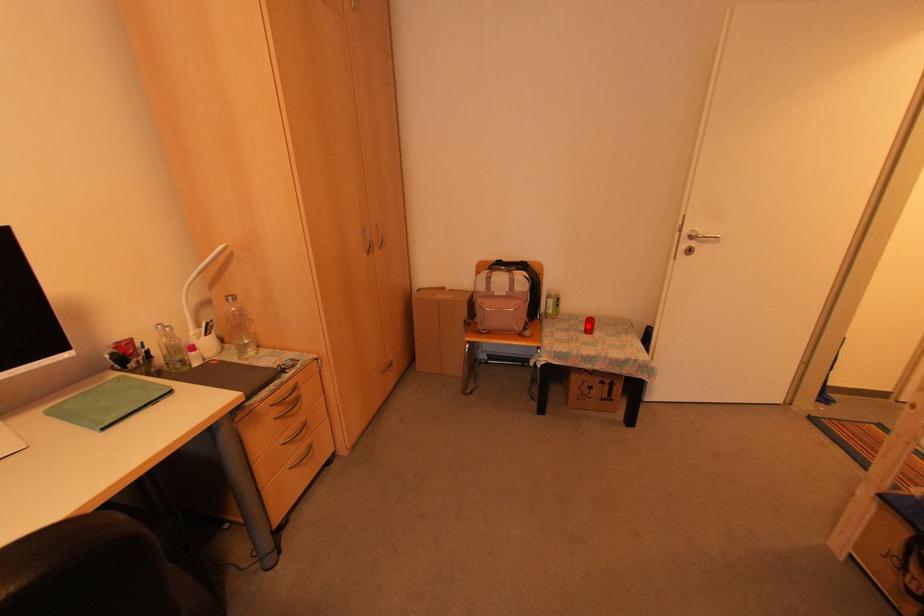
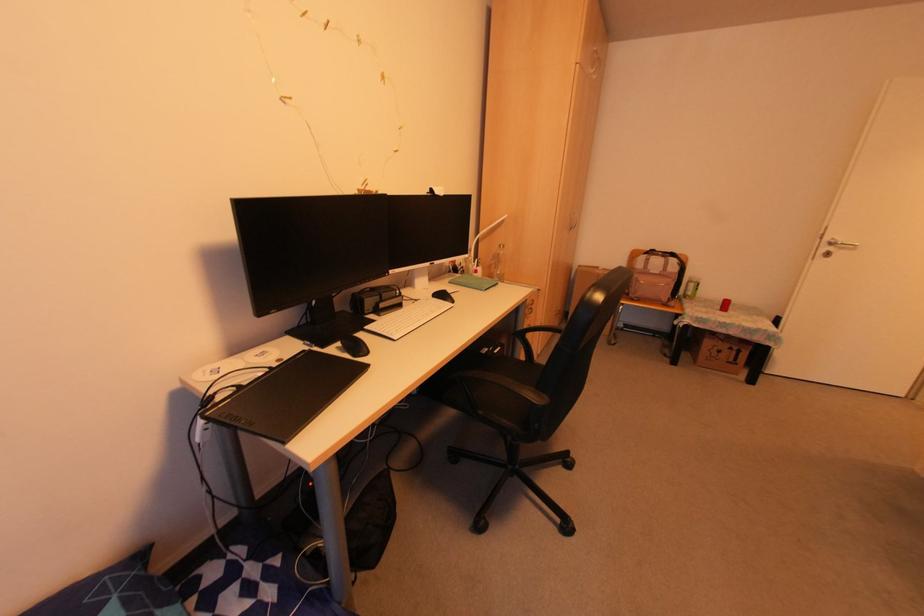
Where in the second image is the point corresponding to the highlighted location from the first image?

(723, 306)